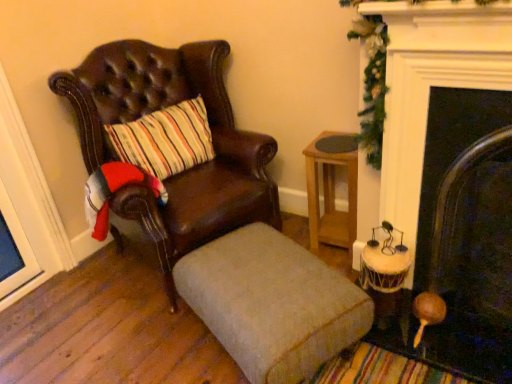
Question: From the image's perspective, is leather chair at left positioned above or below dark wood fireplace at right?

Choices:
 (A) above
 (B) below

Answer: (A)

Question: From a real-world perspective, is leather chair at left positioned above or below dark wood fireplace at right?

Choices:
 (A) above
 (B) below

Answer: (A)

Question: Which object is the closest to the dark wood fireplace at right?

Choices:
 (A) beige fabric ottoman at center
 (B) light brown wooden table at center-right
 (C) green garland at upper right
 (D) leather chair at left

Answer: (C)

Question: Which object is the farthest from the leather chair at left?

Choices:
 (A) dark wood fireplace at right
 (B) green garland at upper right
 (C) light brown wooden table at center-right
 (D) beige fabric ottoman at center

Answer: (A)